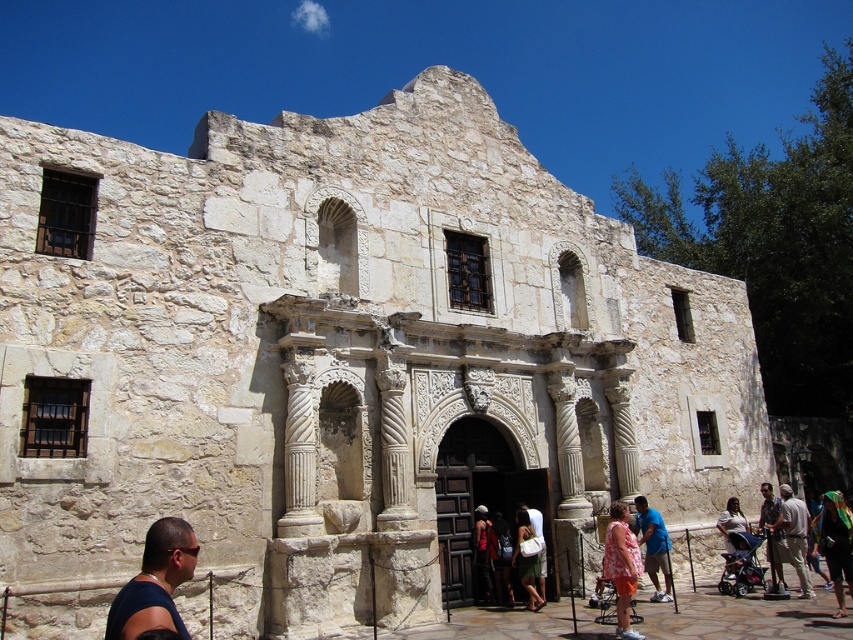
Based on the photo, you are a photographer standing in front of the historic stone building with an arched entryway. You notice a blue cotton shirt at center and a red shirt at center hanging on a clothesline between two poles. Which shirt would cast a shorter shadow due to its position and size?

The blue cotton shirt at center has a smaller size compared to the red shirt at center, so its shadow would be shorter.